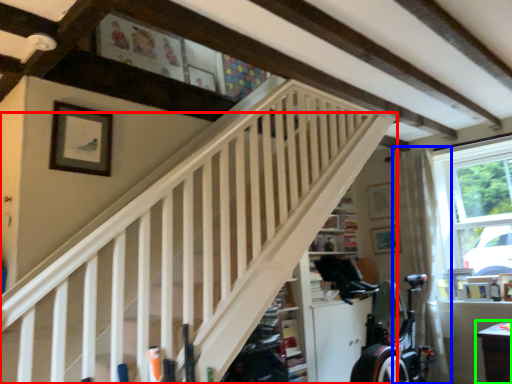
Question: Based on their relative distances, which object is farther from stairs (highlighted by a red box)? Choose from curtain (highlighted by a blue box) and table (highlighted by a green box).

Choices:
 (A) curtain
 (B) table

Answer: (A)